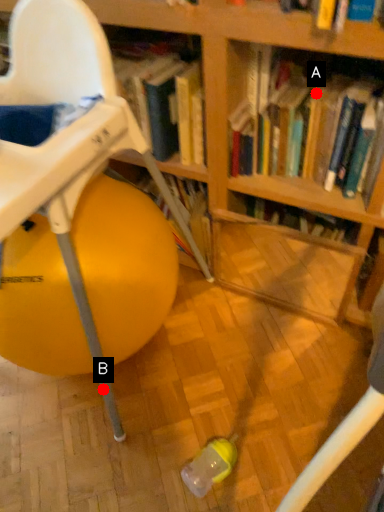
Question: Two points are circled on the image, labeled by A and B beside each circle. Which point is closer to the camera taking this photo?

Choices:
 (A) A is closer
 (B) B is closer

Answer: (B)